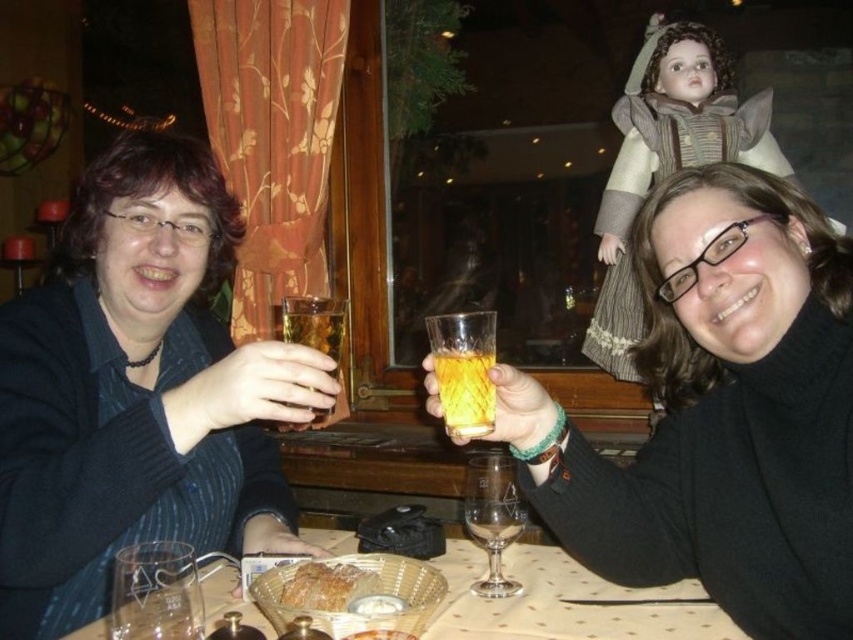
Question: Which point is farther to the camera?

Choices:
 (A) clear glass wine glass at center
 (B) translucent glass at upper center
 (C) clear glass basket at center
 (D) translucent glass at center

Answer: (A)

Question: Is clear glass basket at center below translucent amber liquid at center?

Choices:
 (A) yes
 (B) no

Answer: (A)

Question: Does transparent glass at lower left appear under clear glass wine glass at center?

Choices:
 (A) no
 (B) yes

Answer: (A)

Question: Which point is closer to the camera taking this photo?

Choices:
 (A) (670, 180)
 (B) (460, 392)
 (C) (337, 339)

Answer: (B)

Question: Does matte black sweater at upper left have a smaller size compared to clear glass basket at center?

Choices:
 (A) yes
 (B) no

Answer: (B)

Question: Which object is positioned closest to the clear glass wine glass at center?

Choices:
 (A) golden crispy bread at center
 (B) translucent glass at center

Answer: (A)